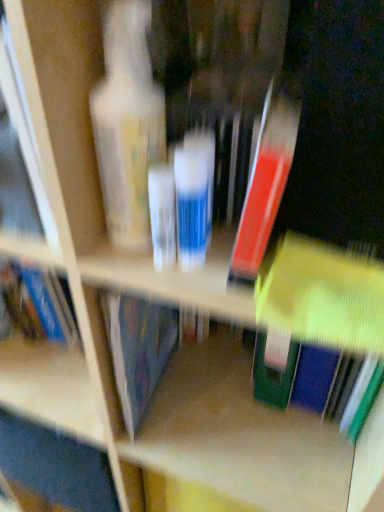
Describe the element at coordinates (322, 296) in the screenshot. I see `matte yellow book at center, which appears as the 2th book when viewed from the top` at that location.

Where is `matte plastic bottle at left`? matte plastic bottle at left is located at coordinates (73, 177).

Does matte red book at center, marked as the 2th book in a bottom-to-top arrangement, touch matte yellow book at center, placed as the 1th book when sorted from bottom to top?

Yes, matte red book at center, marked as the 2th book in a bottom-to-top arrangement, is in contact with matte yellow book at center, placed as the 1th book when sorted from bottom to top.

From the picture: Looking at the image, does matte red book at center, positioned as the first book in top-to-bottom order, seem bigger or smaller compared to matte yellow book at center, which appears as the 2th book when viewed from the top?

In the image, matte red book at center, positioned as the first book in top-to-bottom order, appears to be smaller than matte yellow book at center, which appears as the 2th book when viewed from the top.

In terms of width, does matte red book at center, marked as the 2th book in a bottom-to-top arrangement, look wider or thinner when compared to matte yellow book at center, placed as the 1th book when sorted from bottom to top?

In the image, matte red book at center, marked as the 2th book in a bottom-to-top arrangement, appears to be wider than matte yellow book at center, placed as the 1th book when sorted from bottom to top.

Considering the points (261, 290) and (76, 68), which point is in front, point (261, 290) or point (76, 68)?

The point (76, 68) is closer.

Measure the distance from matte yellow book at center, placed as the 1th book when sorted from bottom to top, to matte plastic bottle at left.

matte yellow book at center, placed as the 1th book when sorted from bottom to top, is 10.00 inches from matte plastic bottle at left.

Can you confirm if matte yellow book at center, placed as the 1th book when sorted from bottom to top, is positioned to the right of matte plastic bottle at left?

Correct, you'll find matte yellow book at center, placed as the 1th book when sorted from bottom to top, to the right of matte plastic bottle at left.

Is matte yellow book at center, placed as the 1th book when sorted from bottom to top, looking in the opposite direction of matte plastic bottle at left?

No, matte yellow book at center, placed as the 1th book when sorted from bottom to top, is not facing the opposite direction of matte plastic bottle at left.

Is matte plastic bottle at left closer to the viewer compared to translucent plastic tube at center?

Yes, the depth of matte plastic bottle at left is less than that of translucent plastic tube at center.

Considering the positions of points (29, 23) and (193, 248), is point (29, 23) farther from camera compared to point (193, 248)?

No, (29, 23) is in front of (193, 248).

Does matte plastic bottle at left turn towards translucent plastic tube at center?

No, matte plastic bottle at left is not oriented towards translucent plastic tube at center.

Considering the sizes of objects matte red book at center, marked as the 2th book in a bottom-to-top arrangement, and translucent plastic tube at center in the image provided, who is bigger, matte red book at center, marked as the 2th book in a bottom-to-top arrangement, or translucent plastic tube at center?

Bigger between the two is matte red book at center, marked as the 2th book in a bottom-to-top arrangement.

Between matte red book at center, marked as the 2th book in a bottom-to-top arrangement, and translucent plastic tube at center, which one is positioned in front?

matte red book at center, marked as the 2th book in a bottom-to-top arrangement, is closer to the camera.

In the scene shown: Considering the sizes of objects matte red book at center, marked as the 2th book in a bottom-to-top arrangement, and translucent plastic tube at center in the image provided, who is shorter, matte red book at center, marked as the 2th book in a bottom-to-top arrangement, or translucent plastic tube at center?

Standing shorter between the two is translucent plastic tube at center.

From the image's perspective, does matte plastic bottle at left appear lower than matte yellow book at center, placed as the 1th book when sorted from bottom to top?

No, from the image's perspective, matte plastic bottle at left is not beneath matte yellow book at center, placed as the 1th book when sorted from bottom to top.

Between matte plastic bottle at left and matte yellow book at center, placed as the 1th book when sorted from bottom to top, which one has larger size?

With larger size is matte plastic bottle at left.

Considering the positions of point (40, 96) and point (352, 289), is point (40, 96) closer or farther from the camera than point (352, 289)?

Point (40, 96) appears to be closer to the viewer than point (352, 289).

Starting from the matte plastic bottle at left, which book is the 2nd one in front? Please provide its 2D coordinates.

[(265, 185)]

Is matte plastic bottle at left oriented away from matte red book at center, positioned as the first book in top-to-bottom order?

No, matte plastic bottle at left's orientation is not away from matte red book at center, positioned as the first book in top-to-bottom order.

In terms of size, does matte plastic bottle at left appear bigger or smaller than matte red book at center, marked as the 2th book in a bottom-to-top arrangement?

matte plastic bottle at left is bigger than matte red book at center, marked as the 2th book in a bottom-to-top arrangement.

Which object is more forward, matte plastic bottle at left or matte red book at center, positioned as the first book in top-to-bottom order?

matte red book at center, positioned as the first book in top-to-bottom order, is in front.

What's the angular difference between matte red book at center, marked as the 2th book in a bottom-to-top arrangement, and matte plastic bottle at left's facing directions?

3.6 degrees.

Are matte red book at center, positioned as the first book in top-to-bottom order, and matte plastic bottle at left located far from each other?

They are positioned close to each other.

Consider the image. Is matte red book at center, positioned as the first book in top-to-bottom order, oriented away from matte plastic bottle at left?

That's not correct — matte red book at center, positioned as the first book in top-to-bottom order, is not looking away from matte plastic bottle at left.

Which of these two, matte red book at center, positioned as the first book in top-to-bottom order, or matte plastic bottle at left, is thinner?

With smaller width is matte red book at center, positioned as the first book in top-to-bottom order.

At what (x,y) coordinates should I click in order to perform the action: click on book behind the matte red book at center, positioned as the first book in top-to-bottom order. Please return your answer as a coordinate pair (x, y). Looking at the image, I should click on (322, 296).

Identify the location of the 1st book in front when counting from the matte plastic bottle at left. Image resolution: width=384 pixels, height=512 pixels. (322, 296).

Considering their positions, is matte yellow book at center, placed as the 1th book when sorted from bottom to top, positioned closer to translucent plastic tube at center than matte plastic bottle at left?

The object closer to translucent plastic tube at center is matte yellow book at center, placed as the 1th book when sorted from bottom to top.

Estimate the real-world distances between objects in this image. Which object is further from translucent plastic tube at center, matte red book at center, positioned as the first book in top-to-bottom order, or matte yellow book at center, placed as the 1th book when sorted from bottom to top?

matte yellow book at center, placed as the 1th book when sorted from bottom to top, lies further to translucent plastic tube at center than the other object.

Estimate the real-world distances between objects in this image. Which object is further from matte yellow book at center, placed as the 1th book when sorted from bottom to top, matte plastic bottle at left or translucent plastic tube at center?

matte plastic bottle at left lies further to matte yellow book at center, placed as the 1th book when sorted from bottom to top, than the other object.

Based on their spatial positions, is matte plastic bottle at left or translucent plastic tube at center further from matte red book at center, marked as the 2th book in a bottom-to-top arrangement?

matte plastic bottle at left.

Looking at the image, which one is located closer to matte red book at center, marked as the 2th book in a bottom-to-top arrangement, translucent plastic tube at center or matte plastic bottle at left?

translucent plastic tube at center is positioned closer to the anchor matte red book at center, marked as the 2th book in a bottom-to-top arrangement.

Looking at the image, which one is located further to matte yellow book at center, placed as the 1th book when sorted from bottom to top, matte plastic bottle at left or matte red book at center, positioned as the first book in top-to-bottom order?

matte plastic bottle at left.

When comparing their distances from matte plastic bottle at left, does translucent plastic tube at center or matte red book at center, marked as the 2th book in a bottom-to-top arrangement, seem closer?

translucent plastic tube at center lies closer to matte plastic bottle at left than the other object.

Considering their positions, is matte yellow book at center, which appears as the 2th book when viewed from the top, positioned further to matte plastic bottle at left than translucent plastic tube at center?

matte yellow book at center, which appears as the 2th book when viewed from the top, is positioned further to the anchor matte plastic bottle at left.

Locate an element on the screen. The width and height of the screenshot is (384, 512). toiletry between matte plastic bottle at left and matte yellow book at center, which appears as the 2th book when viewed from the top, from left to right is located at coordinates (194, 197).

This screenshot has height=512, width=384. I want to click on book between translucent plastic tube at center and matte yellow book at center, placed as the 1th book when sorted from bottom to top, from left to right, so click(265, 185).

This screenshot has height=512, width=384. What are the coordinates of `book between matte plastic bottle at left and matte yellow book at center, placed as the 1th book when sorted from bottom to top, in the horizontal direction` in the screenshot? It's located at (265, 185).

Where is `toiletry located between matte plastic bottle at left and matte red book at center, marked as the 2th book in a bottom-to-top arrangement, in the left-right direction`? toiletry located between matte plastic bottle at left and matte red book at center, marked as the 2th book in a bottom-to-top arrangement, in the left-right direction is located at coordinates (x=194, y=197).